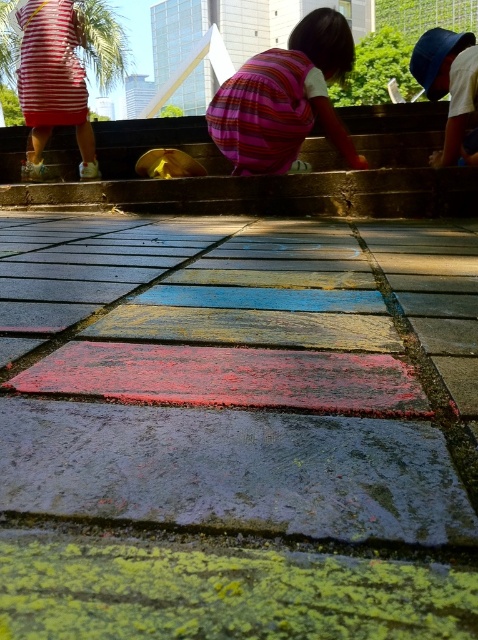
You are a painter who needs to place both the smooth concrete stairs at center and the blue plastic bucket at upper center into a painting. Which object should you make larger to maintain the correct proportions?

The smooth concrete stairs at center should be made larger than the blue plastic bucket at upper center to maintain the correct proportions since it is bigger in real life.

You are a drone operator trying to capture aerial footage of the hopscotch grid. You have two markers placed at point (164, 592) and point (78, 198). Which marker should you prioritize focusing on first to ensure it appears closer to the camera in the footage?

Point (164, 592) is in front of point (78, 198), so you should prioritize focusing on point (164, 592) first to make it appear closer to the camera.